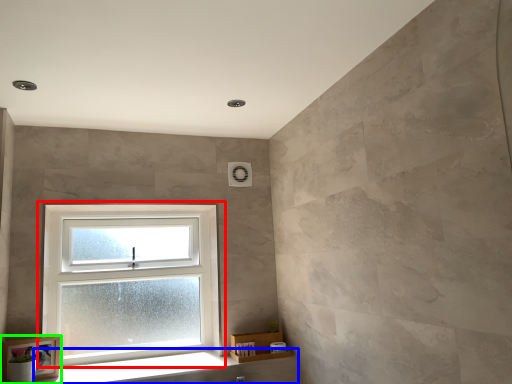
Question: Which object is positioned closest to window (highlighted by a red box)? Select from window sill (highlighted by a blue box) and picture frame (highlighted by a green box).

Choices:
 (A) window sill
 (B) picture frame

Answer: (A)